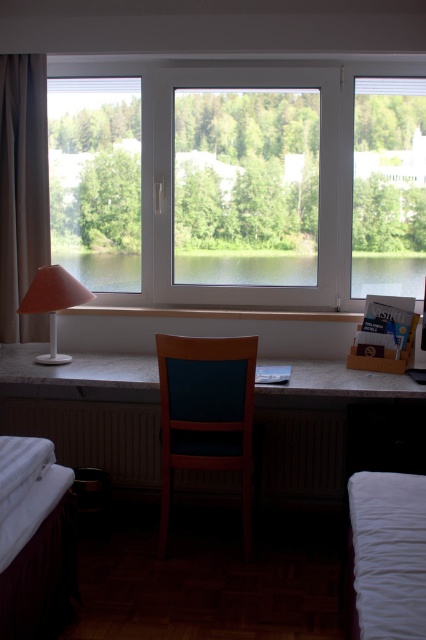
Question: Which point is closer to the camera?

Choices:
 (A) (37, 285)
 (B) (411, 632)
 (C) (60, 573)
 (D) (100, 257)

Answer: (B)

Question: Which point is farther to the camera?

Choices:
 (A) (215, 481)
 (B) (89, 282)
 (C) (8, 298)
 (D) (408, 552)

Answer: (B)

Question: Among these points, which one is nearest to the camera?

Choices:
 (A) (43, 612)
 (B) (39, 268)

Answer: (A)

Question: Observing the image, what is the correct spatial positioning of beige fabric curtain at left in reference to white soft bed at lower left?

Choices:
 (A) right
 (B) left

Answer: (B)

Question: Does wooden table at center have a lesser width compared to transparent glass water at center?

Choices:
 (A) no
 (B) yes

Answer: (A)

Question: Is wooden table at center positioned at the back of white soft bed at lower left?

Choices:
 (A) no
 (B) yes

Answer: (B)